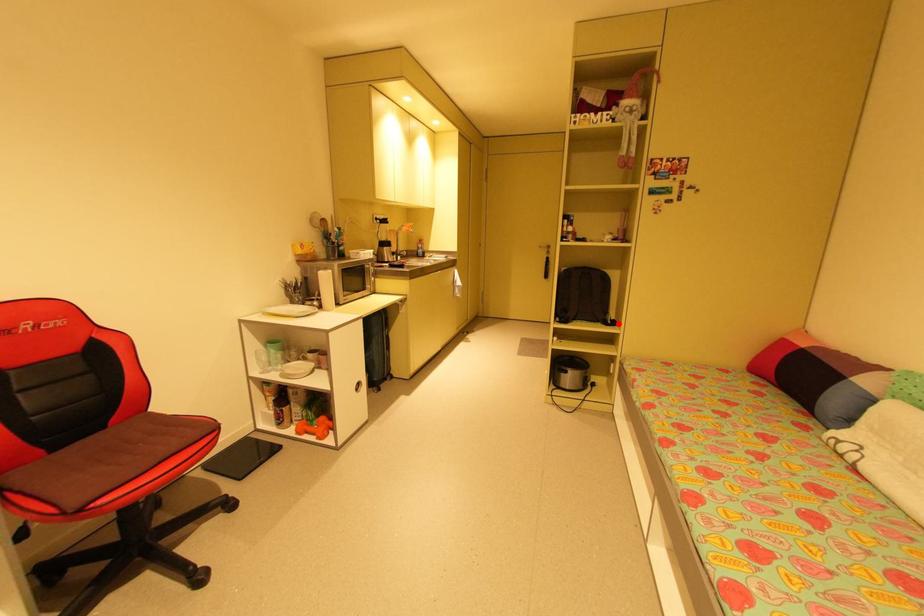
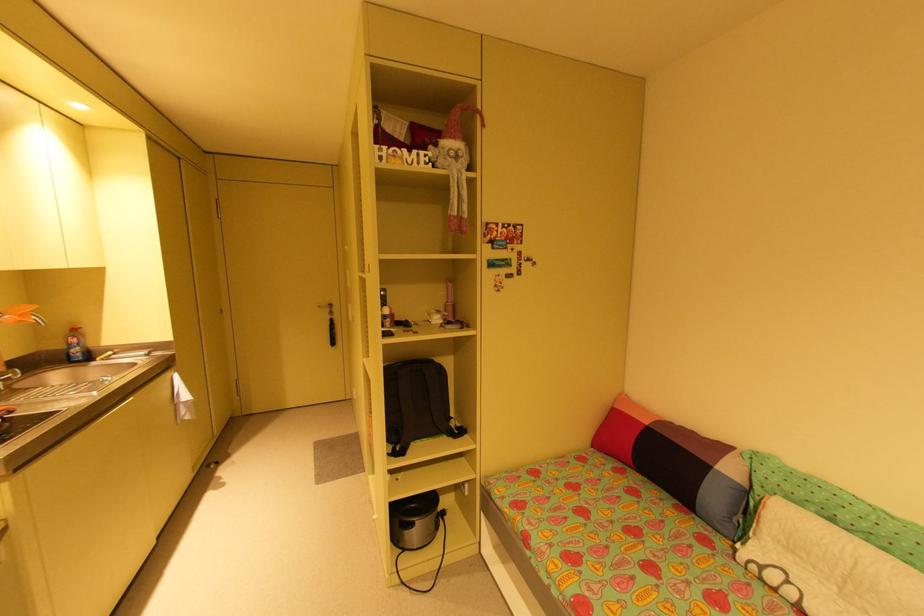
Question: I am providing you with two images of the same scene from different viewpoints. Image1 has a red point marked. In image2, the corresponding 3D location appears at what relative position? Reply with the corresponding letter.

Choices:
 (A) Closer
 (B) Farther

Answer: (B)